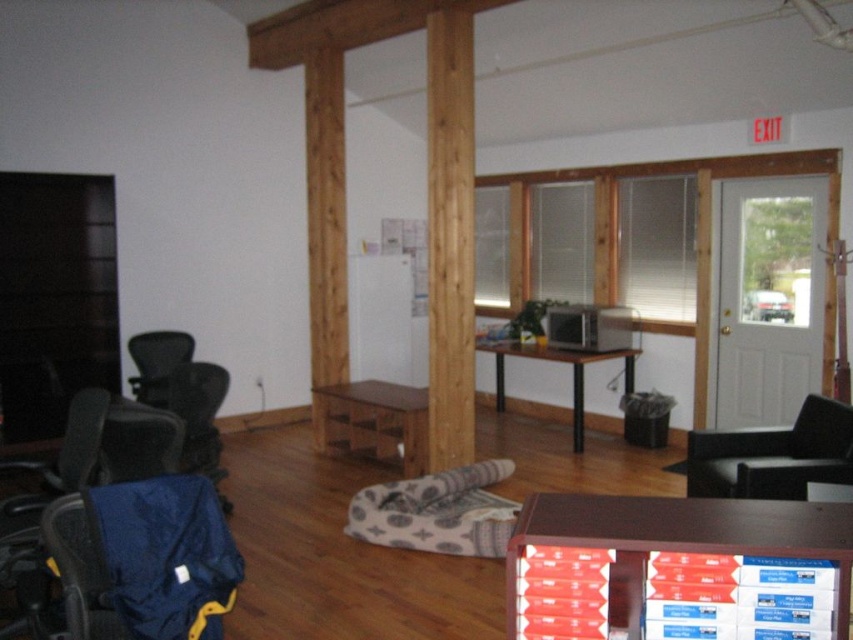
Between brown wood table at center and wooden desk at center, which one is positioned lower?

Positioned lower is brown wood table at center.

Between brown wood table at center and wooden desk at center, which one has more height?

wooden desk at center is taller.

Who is more distant from viewer, (372, 381) or (592, 355)?

Point (372, 381)

Where is `brown wood table at center`? brown wood table at center is located at coordinates (373, 420).

Which of these two, black leather swivel chair at lower right or wooden desk at center, stands taller?

wooden desk at center

The width and height of the screenshot is (853, 640). Describe the element at coordinates (773, 456) in the screenshot. I see `black leather swivel chair at lower right` at that location.

Between point (747, 436) and point (503, 365), which one is positioned behind?

The point (503, 365) is behind.

Image resolution: width=853 pixels, height=640 pixels. I want to click on black leather swivel chair at lower right, so click(x=773, y=456).

Looking at this image, between brown wooden table at lower right and wooden pillar at center, which one appears on the left side from the viewer's perspective?

wooden pillar at center is more to the left.

Where is `brown wooden table at lower right`? brown wooden table at lower right is located at coordinates (677, 568).

Does point (741, 570) come in front of point (332, 378)?

That is True.

This screenshot has height=640, width=853. In order to click on brown wooden table at lower right in this screenshot , I will do (x=677, y=568).